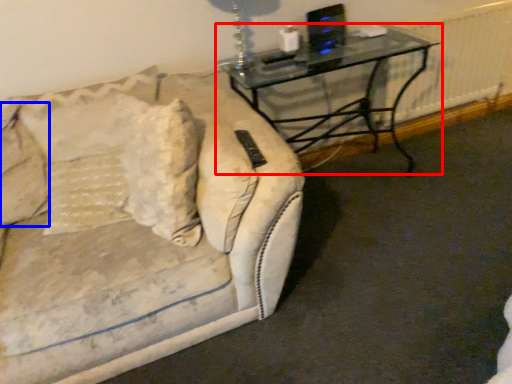
Question: Which object appears farthest to the camera in this image, table (highlighted by a red box) or pillow (highlighted by a blue box)?

Choices:
 (A) table
 (B) pillow

Answer: (A)